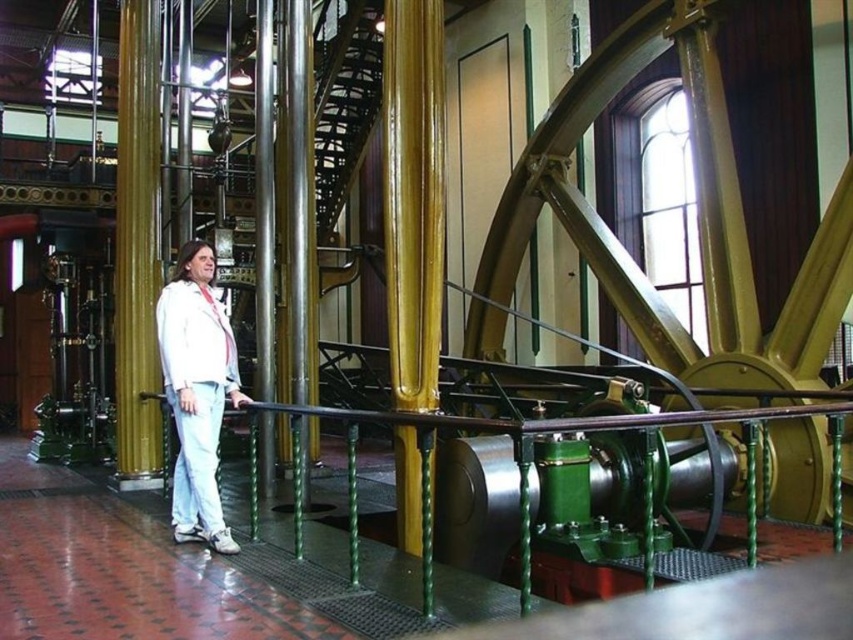
You are an engineer inspecting the machinery in the historical industrial building. You notice the gold polished pillar at center and the white matte jacket at center. Which object is positioned higher in the scene?

The gold polished pillar at center is above the white matte jacket at center, so it is positioned higher in the scene.

You are a maintenance worker in the steam station and need to access the gold polished pillar at center for inspection. However, there is a green polished metal railing at center blocking your path. Can you reach the pillar without moving the railing?

The green polished metal railing at center is in front of the gold polished pillar at center, so you cannot reach the pillar without moving the railing.

You are standing in the historical industrial building and want to take a photo of the point at coordinates point (293, 509). If your camera has a focal length of 50mm and you are currently 10 meters away from the point, should you move closer or farther away to focus properly?

The point point (293, 509) is 5.75 meters from the camera. Since you are currently 10 meters away, you need to move closer to 5.75 meters to focus properly.